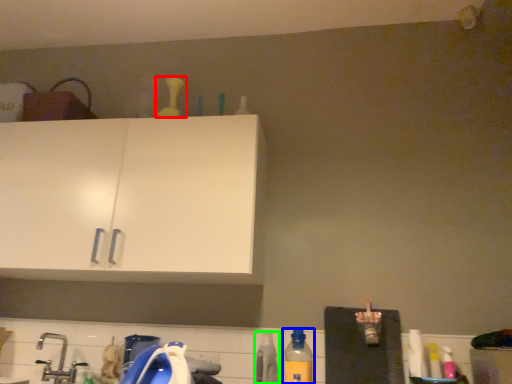
Question: Which object is positioned closest to bottle (highlighted by a red box)? Select from bottle (highlighted by a blue box) and bottle (highlighted by a green box).

Choices:
 (A) bottle
 (B) bottle

Answer: (B)